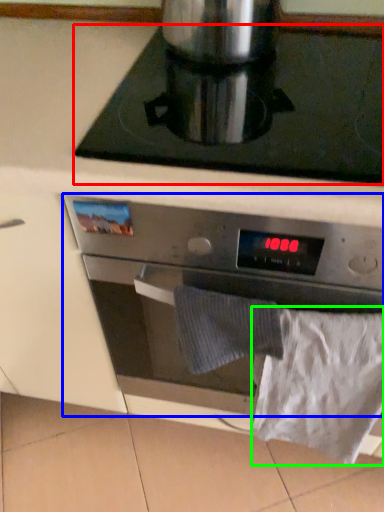
Question: Which is farther away from gas stove (highlighted by a red box)? kitchen appliance (highlighted by a blue box) or sheet (highlighted by a green box)?

Choices:
 (A) kitchen appliance
 (B) sheet

Answer: (B)